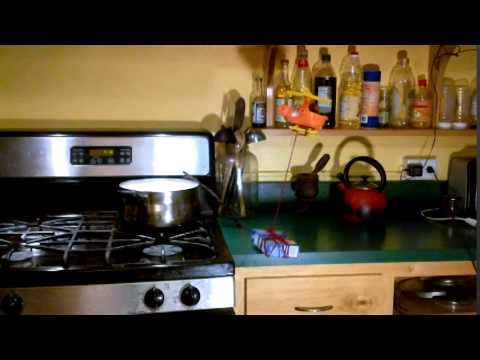
Where is `countertop`? countertop is located at coordinates (328, 238).